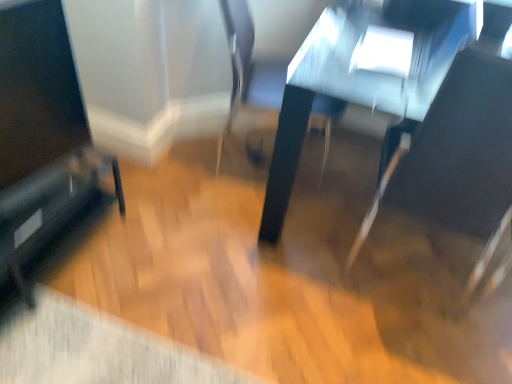
Question: Considering the positions of black glossy screen at left and black glossy speaker at lower left in the image, is black glossy screen at left taller or shorter than black glossy speaker at lower left?

Choices:
 (A) tall
 (B) short

Answer: (A)

Question: Looking at their shapes, would you say black glossy screen at left is wider or thinner than black glossy speaker at lower left?

Choices:
 (A) thin
 (B) wide

Answer: (A)

Question: Considering the real-world distances, which object is farthest from the black glossy speaker at lower left?

Choices:
 (A) black leather swivel chair at right, which is counted as the 1th swivel chair, starting from the right
 (B) metallic silver swivel chair at center, which appears as the first swivel chair when viewed from the left
 (C) shiny black table at center
 (D) black glossy screen at left

Answer: (A)

Question: Which object is positioned closest to the metallic silver swivel chair at center, which appears as the first swivel chair when viewed from the left?

Choices:
 (A) shiny black table at center
 (B) black leather swivel chair at right, arranged as the second swivel chair when viewed from the left
 (C) black glossy speaker at lower left
 (D) black glossy screen at left

Answer: (A)